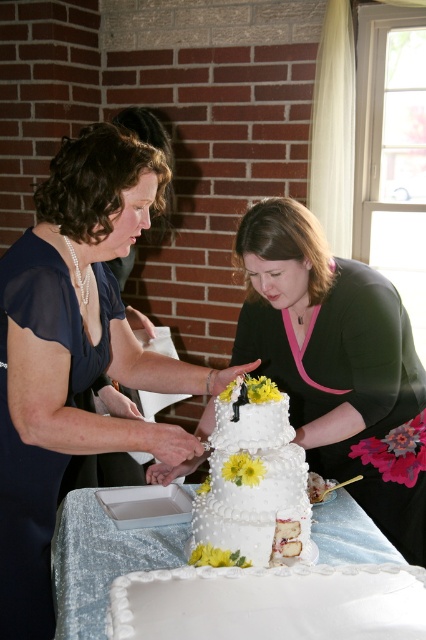
Which is above, matte black dress at center or white textured wedding cake at center?

Positioned higher is matte black dress at center.

Describe the element at coordinates (333, 356) in the screenshot. Image resolution: width=426 pixels, height=640 pixels. I see `matte black dress at center` at that location.

Where is `matte black dress at center`? matte black dress at center is located at coordinates (333, 356).

Image resolution: width=426 pixels, height=640 pixels. I want to click on matte black dress at center, so click(333, 356).

Who is higher up, matte blue dress at center or white textured wedding cake at center?

matte blue dress at center

Is point (16, 544) closer to camera compared to point (279, 460)?

No, it is not.

Image resolution: width=426 pixels, height=640 pixels. In order to click on matte blue dress at center in this screenshot , I will do `click(74, 353)`.

Where is `matte blue dress at center`? The image size is (426, 640). matte blue dress at center is located at coordinates (74, 353).

Describe the element at coordinates (74, 353) in the screenshot. I see `matte blue dress at center` at that location.

Is point (63, 468) farther from camera compared to point (302, 252)?

No, (63, 468) is closer to viewer.

Image resolution: width=426 pixels, height=640 pixels. What are the coordinates of `matte blue dress at center` in the screenshot? It's located at (74, 353).

The height and width of the screenshot is (640, 426). I want to click on matte blue dress at center, so click(x=74, y=353).